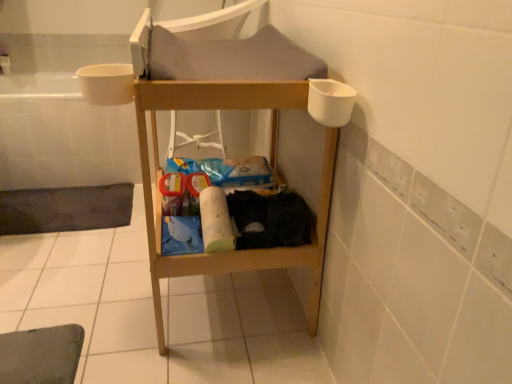
Question: Is dark gray mesh bath mat at lower left further to camera compared to white plastic bath at left?

Choices:
 (A) no
 (B) yes

Answer: (A)

Question: Is dark gray mesh bath mat at lower left positioned with its back to white plastic bath at left?

Choices:
 (A) yes
 (B) no

Answer: (B)

Question: Can you confirm if dark gray mesh bath mat at lower left is wider than white plastic bath at left?

Choices:
 (A) yes
 (B) no

Answer: (B)

Question: Can you confirm if dark gray mesh bath mat at lower left is smaller than white plastic bath at left?

Choices:
 (A) yes
 (B) no

Answer: (A)

Question: Is dark gray mesh bath mat at lower left bigger than white plastic bath at left?

Choices:
 (A) yes
 (B) no

Answer: (B)

Question: From the image's perspective, is white plastic bath at left above or below white matte toilet paper at center?

Choices:
 (A) above
 (B) below

Answer: (A)

Question: Visually, is white plastic bath at left positioned to the left or to the right of white matte toilet paper at center?

Choices:
 (A) left
 (B) right

Answer: (A)

Question: Considering the positions of white plastic bath at left and white matte toilet paper at center in the image, is white plastic bath at left bigger or smaller than white matte toilet paper at center?

Choices:
 (A) big
 (B) small

Answer: (A)

Question: From their relative heights in the image, would you say white plastic bath at left is taller or shorter than white matte toilet paper at center?

Choices:
 (A) tall
 (B) short

Answer: (A)

Question: From the image's perspective, relative to white plastic bath at left, is white matte toilet paper at center above or below?

Choices:
 (A) above
 (B) below

Answer: (B)

Question: Looking at their shapes, would you say white matte toilet paper at center is wider or thinner than white plastic bath at left?

Choices:
 (A) wide
 (B) thin

Answer: (B)

Question: In the image, is white matte toilet paper at center on the left side or the right side of white plastic bath at left?

Choices:
 (A) right
 (B) left

Answer: (A)

Question: Is white matte toilet paper at center in front of or behind white plastic bath at left in the image?

Choices:
 (A) behind
 (B) front

Answer: (B)

Question: From the image's perspective, is dark gray mesh bath mat at lower left positioned above or below white plastic bath at left?

Choices:
 (A) above
 (B) below

Answer: (B)

Question: Is dark gray mesh bath mat at lower left situated inside white plastic bath at left or outside?

Choices:
 (A) outside
 (B) inside

Answer: (A)